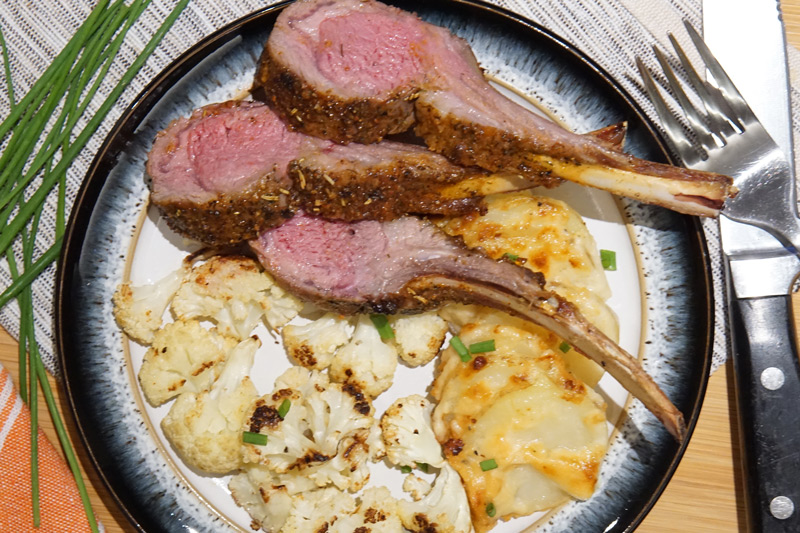
This screenshot has width=800, height=533. Identify the location of table mat. (608, 40).